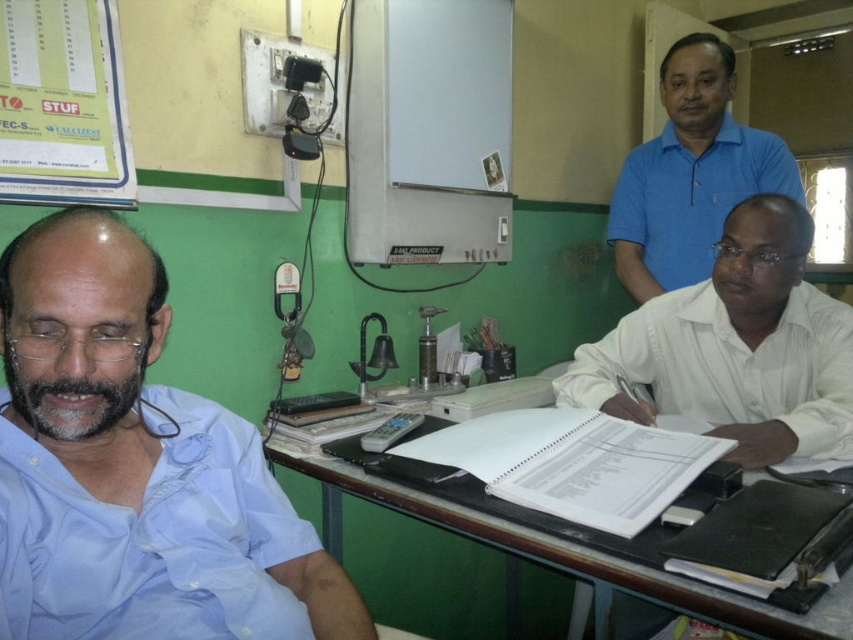
You are organizing the desk items and need to place a new item between the white plastic stapler at center and the gray plastic remote control at center. The new item is 12 inches long. Will it fit in the space between them?

The space between the white plastic stapler at center and the gray plastic remote control at center is 13.21 inches. Since the new item is 12 inches long, it will fit as it is shorter than the available space.

You are standing at the camera position and want to place a 24 inch wide box on the floor. Is there enough space between you and the brown wooden table at center to place it?

The distance between you and the brown wooden table at center is 30.87 inches, which is greater than the 24 inch width of the box, so yes, there is enough space to place the box.

You are organizing the desk items and need to place the white plastic stapler at center and the gray plastic remote control at center into a drawer. Which item should you reach for first if you want to put the closer one away first?

You should reach for the white plastic stapler at center first because it is closer to you than the gray plastic remote control at center, so it should be placed away first.